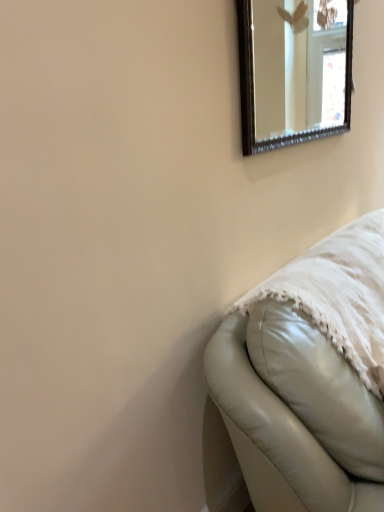
Question: From a real-world perspective, is leather couch at lower right physically located above or below black-framed mirror at upper right?

Choices:
 (A) above
 (B) below

Answer: (B)

Question: Visually, is leather couch at lower right positioned to the left or to the right of black-framed mirror at upper right?

Choices:
 (A) right
 (B) left

Answer: (A)

Question: In the image, is leather couch at lower right positioned in front of or behind black-framed mirror at upper right?

Choices:
 (A) front
 (B) behind

Answer: (A)

Question: From the image's perspective, is black-framed mirror at upper right above or below leather couch at lower right?

Choices:
 (A) below
 (B) above

Answer: (B)

Question: In terms of width, does black-framed mirror at upper right look wider or thinner when compared to leather couch at lower right?

Choices:
 (A) thin
 (B) wide

Answer: (A)

Question: From a real-world perspective, is black-framed mirror at upper right physically located above or below leather couch at lower right?

Choices:
 (A) below
 (B) above

Answer: (B)

Question: Is point click(289, 121) positioned closer to the camera than point click(345, 441)?

Choices:
 (A) closer
 (B) farther

Answer: (B)